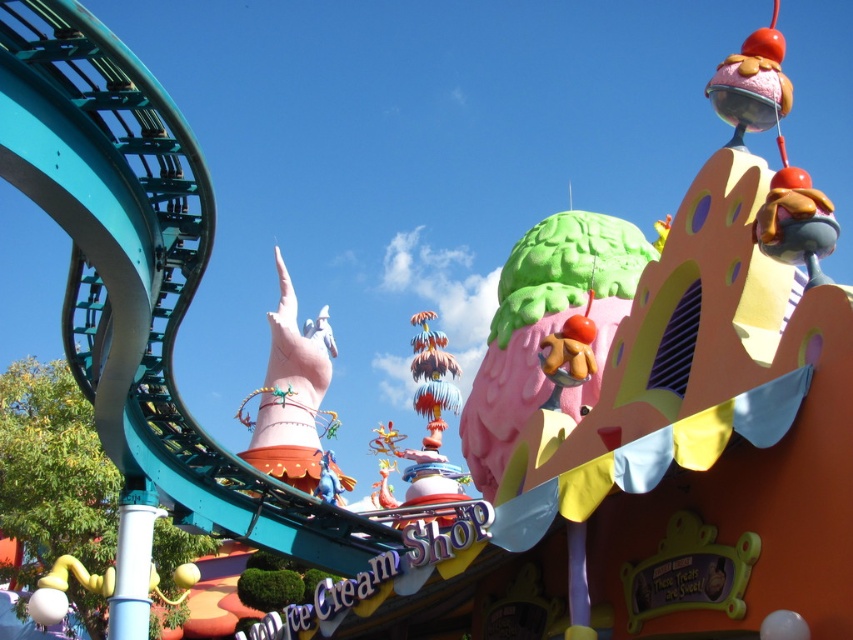
Question: Which point is farther to the camera?

Choices:
 (A) (288, 445)
 (B) (508, 291)

Answer: (A)

Question: Does green matte ice cream cone at upper center appear on the right side of pink matte hand at center?

Choices:
 (A) no
 (B) yes

Answer: (B)

Question: Does green matte ice cream cone at upper center appear over pink matte hand at center?

Choices:
 (A) yes
 (B) no

Answer: (A)

Question: Where is green matte ice cream cone at upper center located in relation to pink matte hand at center in the image?

Choices:
 (A) above
 (B) below

Answer: (A)

Question: Which point is farther from the camera taking this photo?

Choices:
 (A) (521, 280)
 (B) (318, 387)

Answer: (B)